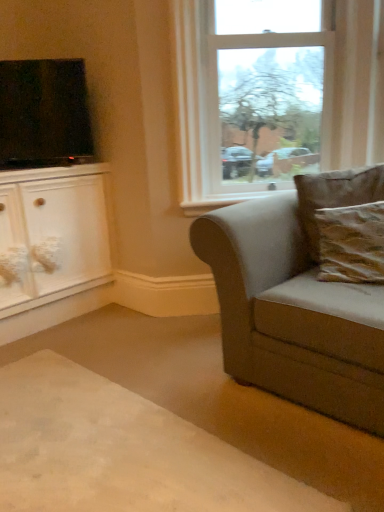
Question: Considering the relative positions of clear glass window at upper center and brown textured pillow at right, the 2th pillow positioned from the back, in the image provided, is clear glass window at upper center behind brown textured pillow at right, the 2th pillow positioned from the back,?

Choices:
 (A) no
 (B) yes

Answer: (B)

Question: Is brown textured pillow at right, which is the first pillow in front-to-back order, at the back of clear glass window at upper center?

Choices:
 (A) no
 (B) yes

Answer: (A)

Question: Is clear glass window at upper center facing towards brown textured pillow at right, which is the first pillow in front-to-back order?

Choices:
 (A) no
 (B) yes

Answer: (B)

Question: Can you confirm if clear glass window at upper center is wider than brown textured pillow at right, the 2th pillow positioned from the back?

Choices:
 (A) yes
 (B) no

Answer: (B)

Question: Does clear glass window at upper center appear on the left side of brown textured pillow at right, which is the first pillow in front-to-back order?

Choices:
 (A) no
 (B) yes

Answer: (B)

Question: In terms of width, does brown textured pillow at right, the 2th pillow positioned from the back, look wider or thinner when compared to white glossy cabinet at left?

Choices:
 (A) wide
 (B) thin

Answer: (B)

Question: In terms of height, does brown textured pillow at right, the 2th pillow positioned from the back, look taller or shorter compared to white glossy cabinet at left?

Choices:
 (A) tall
 (B) short

Answer: (B)

Question: In terms of size, does brown textured pillow at right, the 2th pillow positioned from the back, appear bigger or smaller than white glossy cabinet at left?

Choices:
 (A) big
 (B) small

Answer: (B)

Question: Choose the correct answer: Is brown textured pillow at right, which is the first pillow in front-to-back order, inside white glossy cabinet at left or outside it?

Choices:
 (A) outside
 (B) inside

Answer: (A)

Question: Considering the positions of white glossy cabinet at left and carpet at lower left in the image, is white glossy cabinet at left taller or shorter than carpet at lower left?

Choices:
 (A) tall
 (B) short

Answer: (A)

Question: In the image, is white glossy cabinet at left on the left side or the right side of carpet at lower left?

Choices:
 (A) right
 (B) left

Answer: (B)

Question: In terms of size, does white glossy cabinet at left appear bigger or smaller than carpet at lower left?

Choices:
 (A) small
 (B) big

Answer: (B)

Question: From a real-world perspective, relative to carpet at lower left, is white glossy cabinet at left vertically above or below?

Choices:
 (A) below
 (B) above

Answer: (B)

Question: From a real-world perspective, relative to carpet at lower left, is clear glass window at upper center vertically above or below?

Choices:
 (A) below
 (B) above

Answer: (B)

Question: Is clear glass window at upper center in front of or behind carpet at lower left in the image?

Choices:
 (A) front
 (B) behind

Answer: (B)